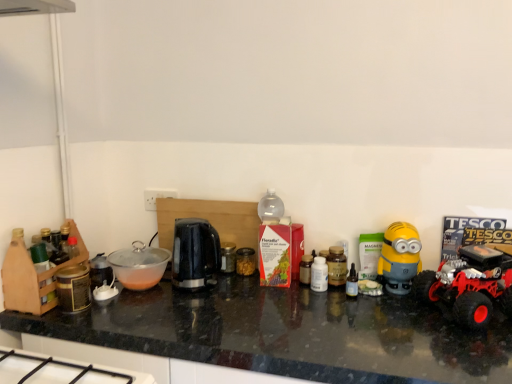
I want to click on vacant area that is situated to the right of white plastic bottle at center, marked as the second bottle in a left-to-right arrangement, so click(x=374, y=299).